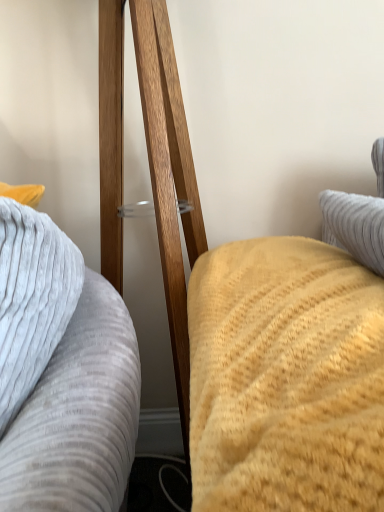
What are the coordinates of `gray textured pillow at left, which is the 1th furniture from left to right` in the screenshot? It's located at (62, 373).

Measure the distance between point [95,327] and camera.

The distance of point [95,327] from camera is 26.06 inches.

Image resolution: width=384 pixels, height=512 pixels. What do you see at coordinates (62, 373) in the screenshot? I see `gray textured pillow at left, which is the 1th furniture from left to right` at bounding box center [62, 373].

The image size is (384, 512). Describe the element at coordinates (169, 180) in the screenshot. I see `yellow textured blanket at right, acting as the 1th furniture starting from the right` at that location.

What is the approximate height of yellow textured blanket at right, which is counted as the 2th furniture, starting from the left?

The height of yellow textured blanket at right, which is counted as the 2th furniture, starting from the left, is 11.01 inches.

You are a GUI agent. You are given a task and a screenshot of the screen. Output one action in this format:
    pyautogui.click(x=<x>, y=<y>)
    Task: Click on the yellow textured blanket at right, which is counted as the 2th furniture, starting from the left
    
    Given the screenshot: What is the action you would take?
    pyautogui.click(x=169, y=180)

At what (x,y) coordinates should I click in order to perform the action: click on gray textured pillow at left, positioned as the second furniture in right-to-left order. Please return your answer as a coordinate pair (x, y). This screenshot has height=512, width=384. Looking at the image, I should click on (62, 373).

Considering the relative positions of yellow textured blanket at right, which is counted as the 2th furniture, starting from the left, and gray textured pillow at left, which is the 1th furniture from left to right, in the image provided, is yellow textured blanket at right, which is counted as the 2th furniture, starting from the left, to the left of gray textured pillow at left, which is the 1th furniture from left to right, from the viewer's perspective?

In fact, yellow textured blanket at right, which is counted as the 2th furniture, starting from the left, is to the right of gray textured pillow at left, which is the 1th furniture from left to right.

Based on the photo, between yellow textured blanket at right, acting as the 1th furniture starting from the right, and gray textured pillow at left, positioned as the second furniture in right-to-left order, which one is positioned behind?

gray textured pillow at left, positioned as the second furniture in right-to-left order, is further from the camera.

Does point (180, 386) come in front of point (37, 399)?

No, it is not.

Based on the photo, from the image's perspective, is yellow textured blanket at right, which is counted as the 2th furniture, starting from the left, on gray textured pillow at left, positioned as the second furniture in right-to-left order?

Indeed, from the image's perspective, yellow textured blanket at right, which is counted as the 2th furniture, starting from the left, is shown above gray textured pillow at left, positioned as the second furniture in right-to-left order.

From a real-world perspective, is yellow textured blanket at right, which is counted as the 2th furniture, starting from the left, located higher than gray textured pillow at left, positioned as the second furniture in right-to-left order?

Yes, from a real-world perspective, yellow textured blanket at right, which is counted as the 2th furniture, starting from the left, is over gray textured pillow at left, positioned as the second furniture in right-to-left order

Considering the relative sizes of yellow textured blanket at right, acting as the 1th furniture starting from the right, and gray textured pillow at left, positioned as the second furniture in right-to-left order, in the image provided, is yellow textured blanket at right, acting as the 1th furniture starting from the right, wider than gray textured pillow at left, positioned as the second furniture in right-to-left order,?

Correct, the width of yellow textured blanket at right, acting as the 1th furniture starting from the right, exceeds that of gray textured pillow at left, positioned as the second furniture in right-to-left order.

Considering the sizes of objects yellow textured blanket at right, which is counted as the 2th furniture, starting from the left, and gray textured pillow at left, positioned as the second furniture in right-to-left order, in the image provided, who is taller, yellow textured blanket at right, which is counted as the 2th furniture, starting from the left, or gray textured pillow at left, positioned as the second furniture in right-to-left order,?

gray textured pillow at left, positioned as the second furniture in right-to-left order, is taller.

Considering the sizes of objects yellow textured blanket at right, which is counted as the 2th furniture, starting from the left, and gray textured pillow at left, positioned as the second furniture in right-to-left order, in the image provided, who is bigger, yellow textured blanket at right, which is counted as the 2th furniture, starting from the left, or gray textured pillow at left, positioned as the second furniture in right-to-left order,?

gray textured pillow at left, positioned as the second furniture in right-to-left order.

Is yellow textured blanket at right, which is counted as the 2th furniture, starting from the left, positioned beyond the bounds of gray textured pillow at left, positioned as the second furniture in right-to-left order?

Yes.

Is yellow textured blanket at right, which is counted as the 2th furniture, starting from the left, not close to gray textured pillow at left, positioned as the second furniture in right-to-left order?

No.

Does yellow textured blanket at right, acting as the 1th furniture starting from the right, turn towards gray textured pillow at left, positioned as the second furniture in right-to-left order?

No, yellow textured blanket at right, acting as the 1th furniture starting from the right, is not oriented towards gray textured pillow at left, positioned as the second furniture in right-to-left order.

What's the angular difference between yellow textured blanket at right, which is counted as the 2th furniture, starting from the left, and gray textured pillow at left, which is the 1th furniture from left to right,'s facing directions?

There is a 78.1-degree angle between the facing directions of yellow textured blanket at right, which is counted as the 2th furniture, starting from the left, and gray textured pillow at left, which is the 1th furniture from left to right.

Locate an element on the screen. Image resolution: width=384 pixels, height=512 pixels. furniture behind the yellow textured blanket at right, acting as the 1th furniture starting from the right is located at coordinates (62, 373).

Is gray textured pillow at left, positioned as the second furniture in right-to-left order, at the left side of yellow textured blanket at right, acting as the 1th furniture starting from the right?

Yes.

Does gray textured pillow at left, positioned as the second furniture in right-to-left order, come in front of yellow textured blanket at right, acting as the 1th furniture starting from the right?

No.

Does point (79, 404) lie behind point (145, 26)?

No, it is not.

From the image's perspective, is gray textured pillow at left, which is the 1th furniture from left to right, above or below yellow textured blanket at right, which is counted as the 2th furniture, starting from the left?

Clearly, from the image's perspective, gray textured pillow at left, which is the 1th furniture from left to right, is below yellow textured blanket at right, which is counted as the 2th furniture, starting from the left.

From a real-world perspective, is gray textured pillow at left, which is the 1th furniture from left to right, located beneath yellow textured blanket at right, acting as the 1th furniture starting from the right?

Yes, from a real-world perspective, gray textured pillow at left, which is the 1th furniture from left to right, is under yellow textured blanket at right, acting as the 1th furniture starting from the right.

Considering the sizes of gray textured pillow at left, positioned as the second furniture in right-to-left order, and yellow textured blanket at right, acting as the 1th furniture starting from the right, in the image, is gray textured pillow at left, positioned as the second furniture in right-to-left order, wider or thinner than yellow textured blanket at right, acting as the 1th furniture starting from the right,?

gray textured pillow at left, positioned as the second furniture in right-to-left order, is thinner than yellow textured blanket at right, acting as the 1th furniture starting from the right.

Does gray textured pillow at left, which is the 1th furniture from left to right, have a lesser height compared to yellow textured blanket at right, acting as the 1th furniture starting from the right?

Incorrect, the height of gray textured pillow at left, which is the 1th furniture from left to right, does not fall short of that of yellow textured blanket at right, acting as the 1th furniture starting from the right.

Considering the relative sizes of gray textured pillow at left, positioned as the second furniture in right-to-left order, and yellow textured blanket at right, acting as the 1th furniture starting from the right, in the image provided, is gray textured pillow at left, positioned as the second furniture in right-to-left order, smaller than yellow textured blanket at right, acting as the 1th furniture starting from the right,?

Actually, gray textured pillow at left, positioned as the second furniture in right-to-left order, might be larger than yellow textured blanket at right, acting as the 1th furniture starting from the right.

Based on the photo, choose the correct answer: Is gray textured pillow at left, positioned as the second furniture in right-to-left order, inside yellow textured blanket at right, which is counted as the 2th furniture, starting from the left, or outside it?

gray textured pillow at left, positioned as the second furniture in right-to-left order, cannot be found inside yellow textured blanket at right, which is counted as the 2th furniture, starting from the left.

Is gray textured pillow at left, which is the 1th furniture from left to right, touching yellow textured blanket at right, acting as the 1th furniture starting from the right?

gray textured pillow at left, which is the 1th furniture from left to right, and yellow textured blanket at right, acting as the 1th furniture starting from the right, are not in contact.

Could you tell me if gray textured pillow at left, positioned as the second furniture in right-to-left order, is facing yellow textured blanket at right, which is counted as the 2th furniture, starting from the left?

No, gray textured pillow at left, positioned as the second furniture in right-to-left order, does not turn towards yellow textured blanket at right, which is counted as the 2th furniture, starting from the left.

What's the angular difference between gray textured pillow at left, positioned as the second furniture in right-to-left order, and yellow textured blanket at right, which is counted as the 2th furniture, starting from the left,'s facing directions?

The angle between the facing direction of gray textured pillow at left, positioned as the second furniture in right-to-left order, and the facing direction of yellow textured blanket at right, which is counted as the 2th furniture, starting from the left, is 78.1 degrees.

Measure the distance between gray textured pillow at left, positioned as the second furniture in right-to-left order, and yellow textured blanket at right, acting as the 1th furniture starting from the right.

gray textured pillow at left, positioned as the second furniture in right-to-left order, and yellow textured blanket at right, acting as the 1th furniture starting from the right, are 10.32 inches apart.

Identify the location of furniture to the right of gray textured pillow at left, which is the 1th furniture from left to right. (169, 180).

Locate an element on the screen. Image resolution: width=384 pixels, height=512 pixels. furniture that is above the gray textured pillow at left, which is the 1th furniture from left to right (from the image's perspective) is located at coordinates (169, 180).

Where is `furniture behind the yellow textured blanket at right, which is counted as the 2th furniture, starting from the left`? The height and width of the screenshot is (512, 384). furniture behind the yellow textured blanket at right, which is counted as the 2th furniture, starting from the left is located at coordinates (62, 373).